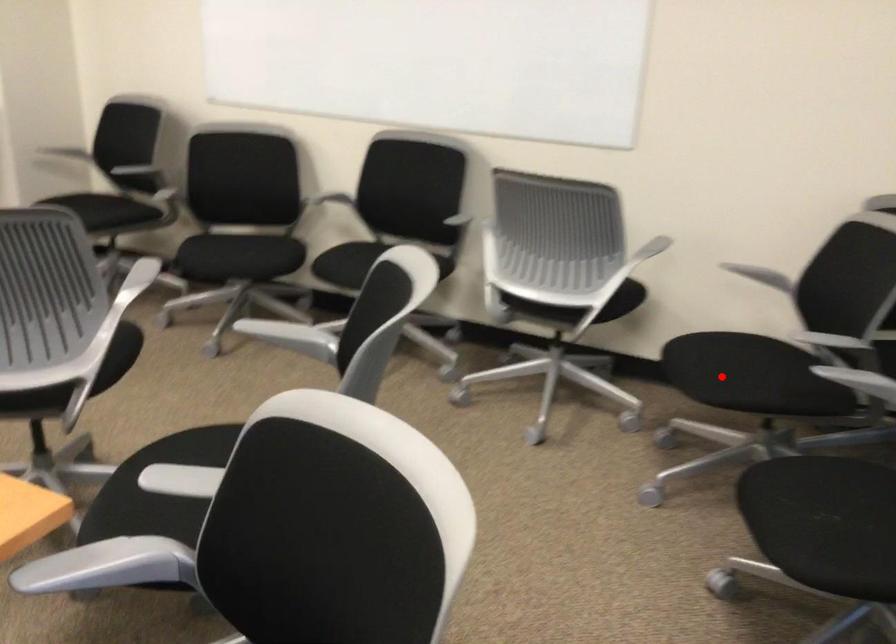
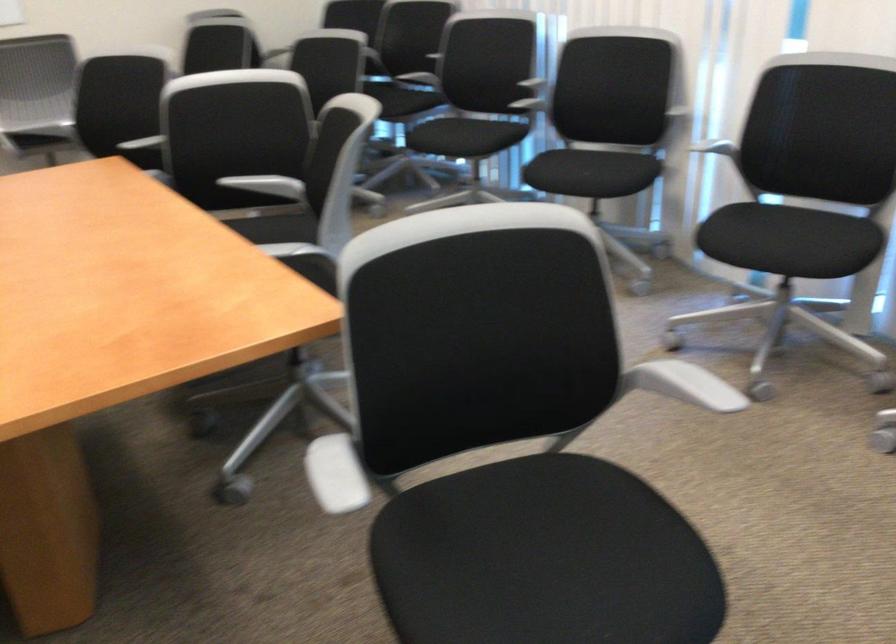
Question: I am providing you with two images of the same scene from different viewpoints. A red point is marked on the first image. At the location where the point appears in image 1, is it still visible in image 2?

Choices:
 (A) Yes
 (B) No

Answer: (B)